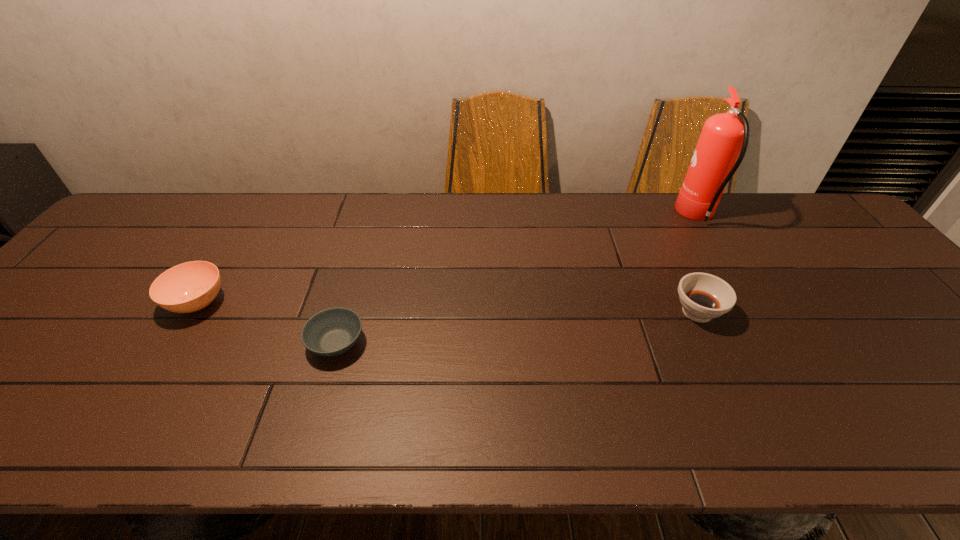
What are the coordinates of `vacant area between the leftmost soup bowl and the rightmost soup bowl` in the screenshot? It's located at (447, 307).

Where is `vacant space in between the tallest object and the shortest soup bowl`? The height and width of the screenshot is (540, 960). vacant space in between the tallest object and the shortest soup bowl is located at coordinates click(x=517, y=279).

The image size is (960, 540). Identify the location of free point between the leftmost soup bowl and the fire extinguisher. (447, 259).

You are a GUI agent. You are given a task and a screenshot of the screen. Output one action in this format:
    pyautogui.click(x=<x>, y=<y>)
    Task: Click on the vacant area that lies between the leftmost soup bowl and the second soup bowl from left to right
    The height and width of the screenshot is (540, 960).
    Given the screenshot: What is the action you would take?
    pyautogui.click(x=267, y=323)

Locate an element on the screen. The height and width of the screenshot is (540, 960). empty space that is in between the rightmost soup bowl and the leftmost soup bowl is located at coordinates (447, 307).

Find the location of a particular element. unoccupied position between the leftmost object and the fire extinguisher is located at coordinates (447, 259).

At what (x,y) coordinates should I click in order to perform the action: click on empty space between the leftmost soup bowl and the shortest soup bowl. Please return your answer as a coordinate pair (x, y). This screenshot has width=960, height=540. Looking at the image, I should click on (267, 323).

You are a GUI agent. You are given a task and a screenshot of the screen. Output one action in this format:
    pyautogui.click(x=<x>, y=<y>)
    Task: Click on the object that is the second closest to the tallest object
    Image resolution: width=960 pixels, height=540 pixels.
    Given the screenshot: What is the action you would take?
    pyautogui.click(x=331, y=332)

Choose which object is the third nearest neighbor to the second object from right to left. Please provide its 2D coordinates. Your answer should be formatted as a tuple, i.e. [(x, y)], where the tuple contains the x and y coordinates of a point satisfying the conditions above.

[(188, 287)]

Identify the location of soup bowl object that ranks as the closest to the second soup bowl from right to left. (188, 287).